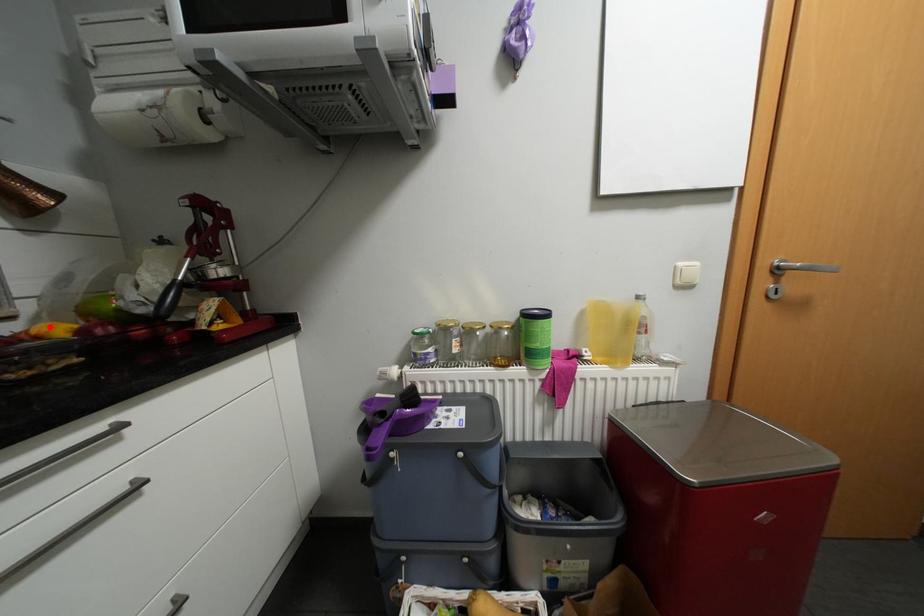
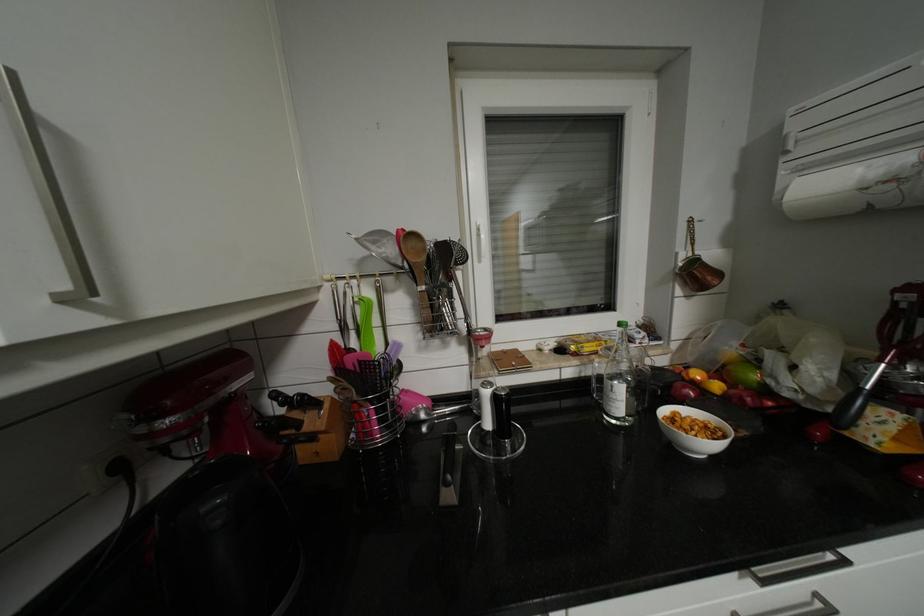
The point at the highlighted location is marked in the first image. Where is the corresponding point in the second image?

(704, 374)